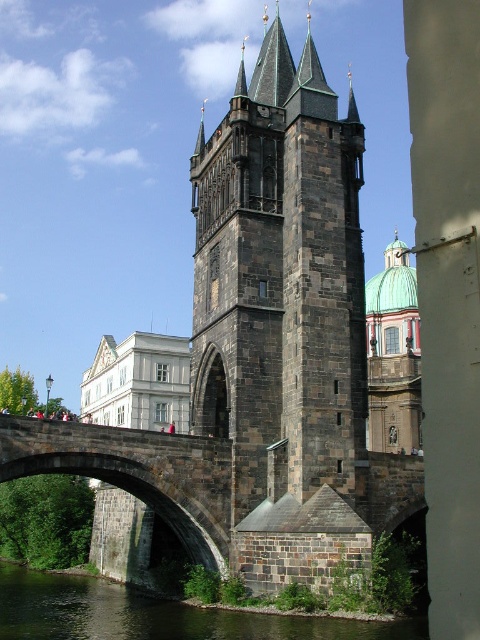
Question: Can you confirm if dark stone tower at center is wider than greenish stone water at lower left?

Choices:
 (A) yes
 (B) no

Answer: (A)

Question: Among these objects, which one is farthest from the camera?

Choices:
 (A) dark stone tower at center
 (B) greenish stone water at lower left

Answer: (A)

Question: Is dark stone tower at center further to the viewer compared to greenish stone water at lower left?

Choices:
 (A) yes
 (B) no

Answer: (A)

Question: Can you confirm if dark stone tower at center is positioned below greenish stone water at lower left?

Choices:
 (A) yes
 (B) no

Answer: (B)

Question: Which point is closer to the camera taking this photo?

Choices:
 (A) (128, 611)
 (B) (238, 353)

Answer: (B)